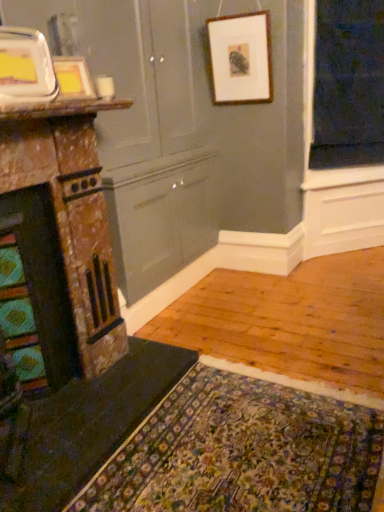
The height and width of the screenshot is (512, 384). In order to click on free point above wooden picture frame at upper center, which is the 3th picture frame in bottom-to-top order (from a real-world perspective) in this screenshot , I will do `click(235, 15)`.